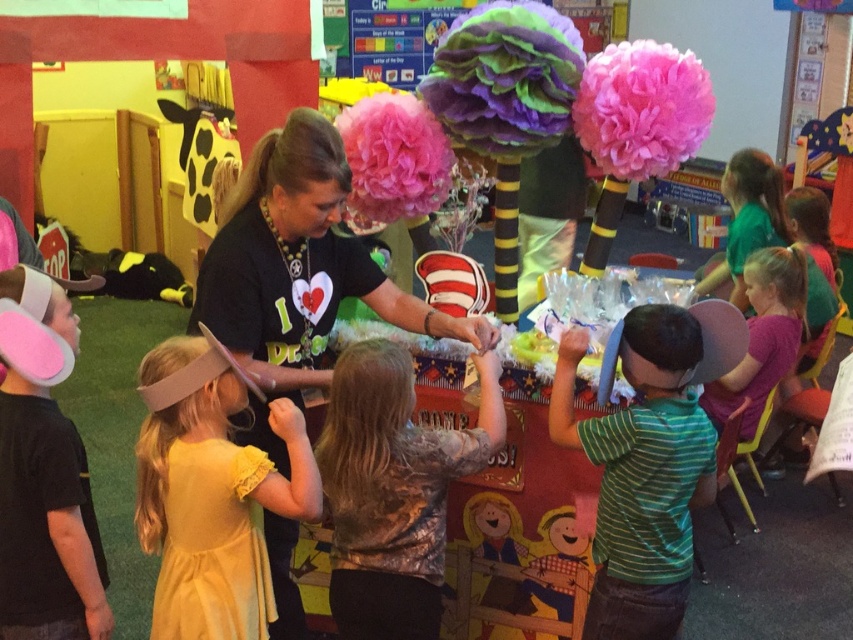
Question: Which object is the farthest from the green striped shirt at center?

Choices:
 (A) black matte shirt at center
 (B) camouflage shirt at center
 (C) yellow satin dress at center

Answer: (C)

Question: Is black matte shirt at center bigger than camouflage shirt at center?

Choices:
 (A) yes
 (B) no

Answer: (A)

Question: Which is nearer to the yellow satin dress at center?

Choices:
 (A) camouflage shirt at center
 (B) black matte shirt at center
 (C) green striped shirt at center

Answer: (B)

Question: Which point appears farthest from the camera in this image?

Choices:
 (A) (659, 502)
 (B) (213, 534)
 (C) (374, 541)

Answer: (C)

Question: Is yellow satin dress at center bigger than green striped shirt at center?

Choices:
 (A) yes
 (B) no

Answer: (B)

Question: Can you confirm if yellow satin dress at center is positioned to the right of camouflage shirt at center?

Choices:
 (A) yes
 (B) no

Answer: (B)